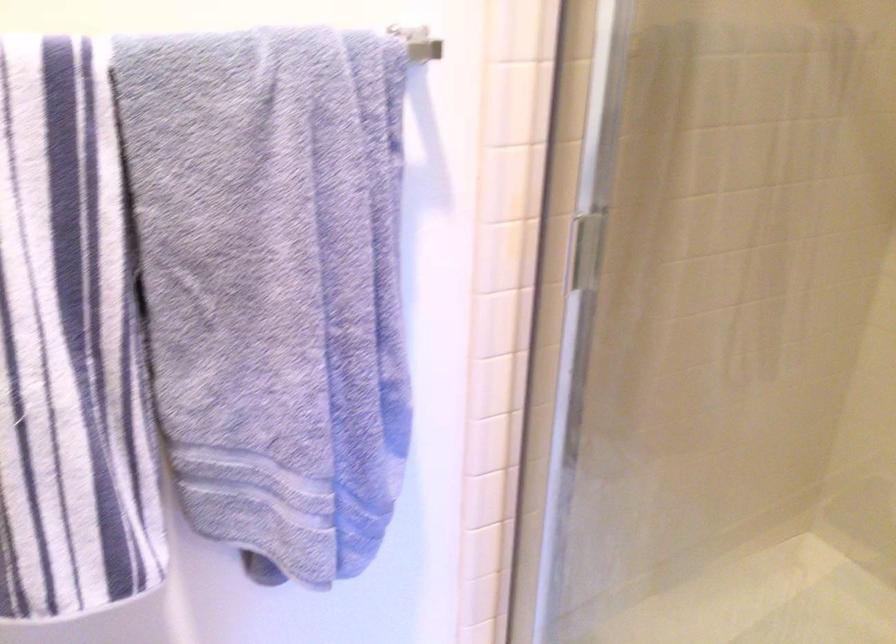
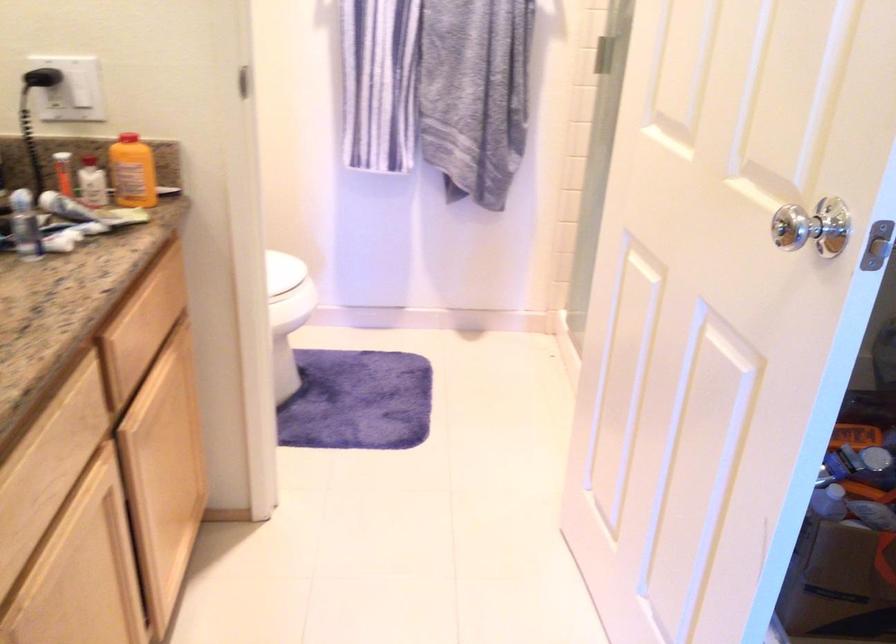
Which direction would the cameraman need to move to produce the second image?

The movement direction of the cameraman is right, backward.